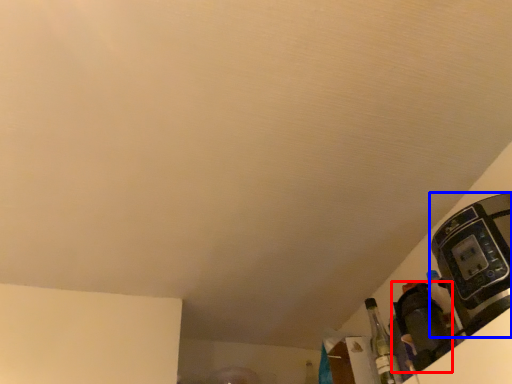
Question: Which object appears closest to the camera in this image, appliance (highlighted by a red box) or coffee machine (highlighted by a blue box)?

Choices:
 (A) appliance
 (B) coffee machine

Answer: (B)